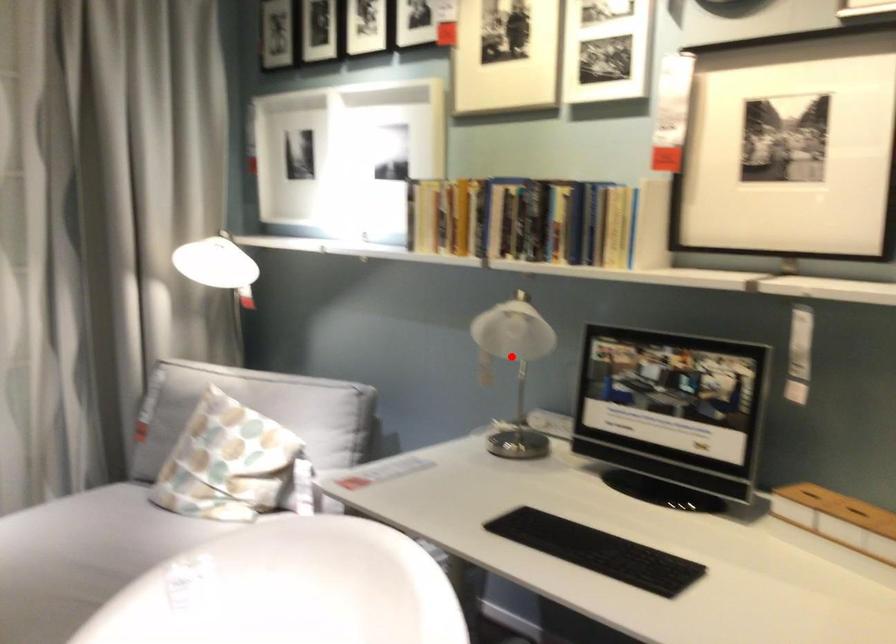
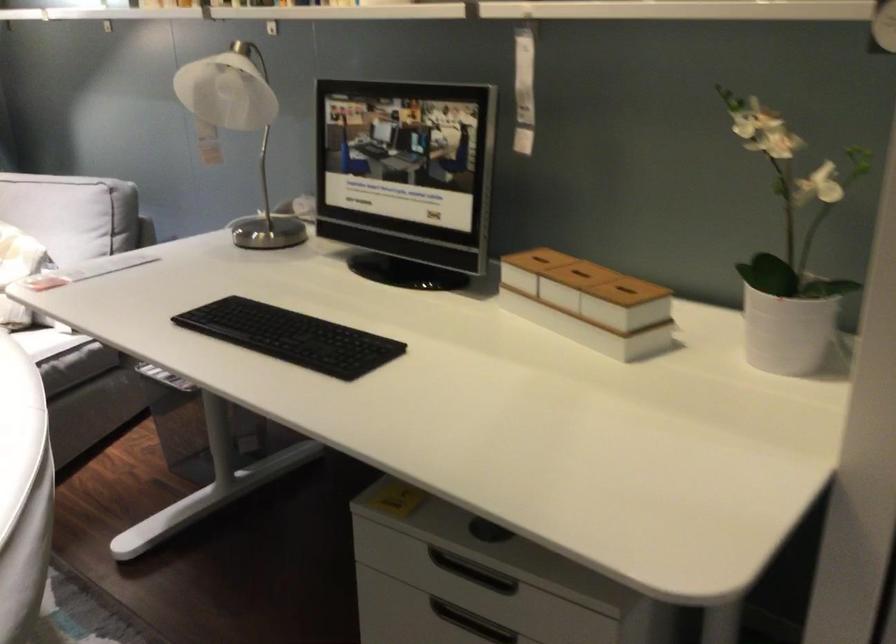
Question: I am providing you with two images of the same scene from different viewpoints. In image1, a red point is highlighted. Considering the same 3D point in image2, which of the following is correct?

Choices:
 (A) It is closer
 (B) It is farther

Answer: (A)